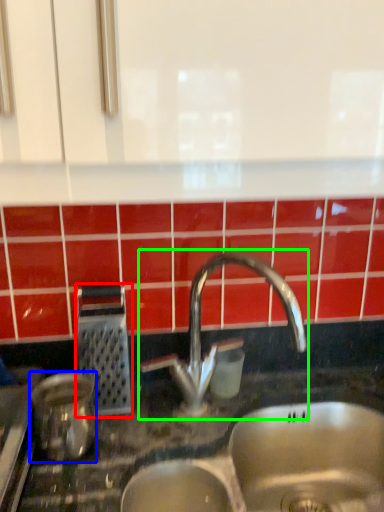
Question: Which object is positioned farthest from appliance (highlighted by a red box)? Select from appliance (highlighted by a blue box) and tap (highlighted by a green box).

Choices:
 (A) appliance
 (B) tap

Answer: (B)